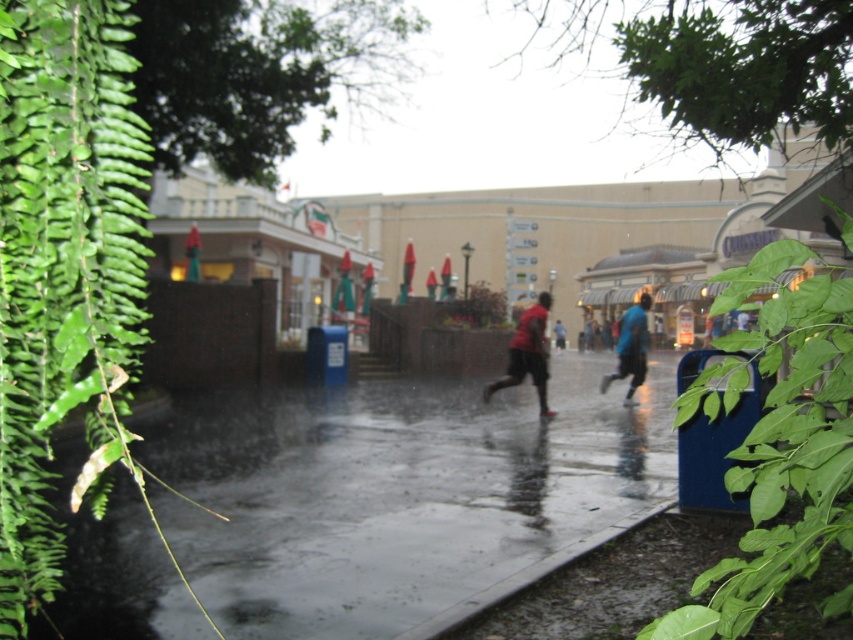
Question: Which point is closer to the camera?

Choices:
 (A) (173, 600)
 (B) (558, 324)

Answer: (A)

Question: Which point is farther to the camera?

Choices:
 (A) blue fabric jacket at center
 (B) green leafy fern at left
 (C) red matte shirt at center
 (D) blue matte jacket at right

Answer: (A)

Question: Can you confirm if green leafy fern at left is positioned below blue matte jacket at right?

Choices:
 (A) yes
 (B) no

Answer: (A)

Question: Is glossy concrete pavement at center thinner than green leafy fern at left?

Choices:
 (A) yes
 (B) no

Answer: (B)

Question: Can you confirm if blue matte jacket at right is wider than blue fabric jacket at center?

Choices:
 (A) yes
 (B) no

Answer: (A)

Question: Which point is closer to the camera taking this photo?

Choices:
 (A) (555, 336)
 (B) (538, 348)
 (C) (534, 465)

Answer: (C)